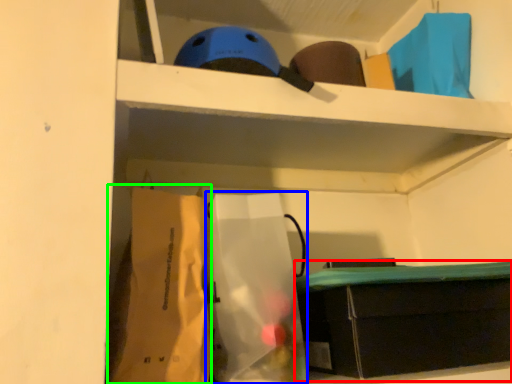
Question: Which object is positioned farthest from furniture (highlighted by a red box)? Select from paper bag (highlighted by a blue box) and paper bag (highlighted by a green box).

Choices:
 (A) paper bag
 (B) paper bag

Answer: (B)